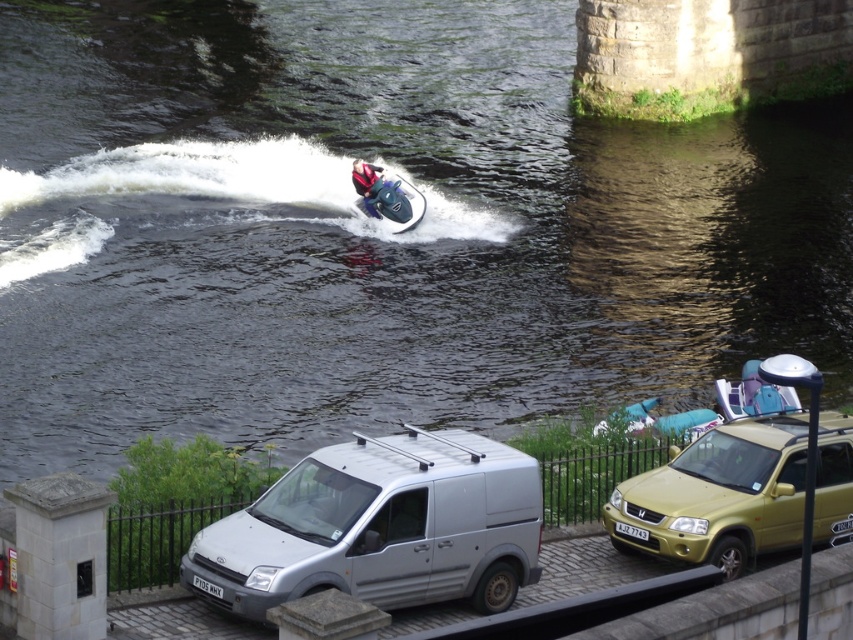
Question: Can you confirm if silver metallic van at lower center is positioned to the right of red fabric helmet at upper center?

Choices:
 (A) yes
 (B) no

Answer: (A)

Question: Which of the following is the closest to the observer?

Choices:
 (A) silver metallic van at lower center
 (B) metallic blue jet ski at center

Answer: (A)

Question: Which object appears closest to the camera in this image?

Choices:
 (A) gold metallic suv at lower right
 (B) metallic blue jet ski at center
 (C) silver metallic van at lower center
 (D) red fabric helmet at upper center

Answer: (C)

Question: Does gold metallic suv at lower right appear over red fabric helmet at upper center?

Choices:
 (A) yes
 (B) no

Answer: (B)

Question: Observing the image, what is the correct spatial positioning of metallic blue jet ski at center in reference to red fabric helmet at upper center?

Choices:
 (A) above
 (B) below

Answer: (B)

Question: Which of the following is the closest to the observer?

Choices:
 (A) red fabric helmet at upper center
 (B) gold metallic suv at lower right

Answer: (B)